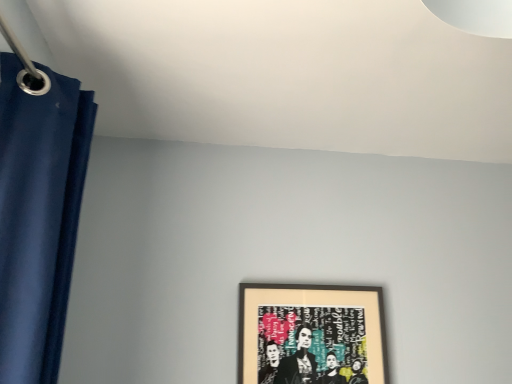
Question: In terms of width, does matte blue curtain at left look wider or thinner when compared to wooden framed artwork at center?

Choices:
 (A) wide
 (B) thin

Answer: (A)

Question: Does point (8, 97) appear closer or farther from the camera than point (358, 334)?

Choices:
 (A) farther
 (B) closer

Answer: (B)

Question: Based on their sizes in the image, would you say matte blue curtain at left is bigger or smaller than wooden framed artwork at center?

Choices:
 (A) small
 (B) big

Answer: (B)

Question: Is point (281, 327) positioned closer to the camera than point (42, 329)?

Choices:
 (A) farther
 (B) closer

Answer: (A)

Question: Is wooden framed artwork at center wider or thinner than matte blue curtain at left?

Choices:
 (A) wide
 (B) thin

Answer: (B)

Question: From a real-world perspective, relative to matte blue curtain at left, is wooden framed artwork at center vertically above or below?

Choices:
 (A) above
 (B) below

Answer: (B)

Question: In the image, is wooden framed artwork at center positioned in front of or behind matte blue curtain at left?

Choices:
 (A) behind
 (B) front

Answer: (A)